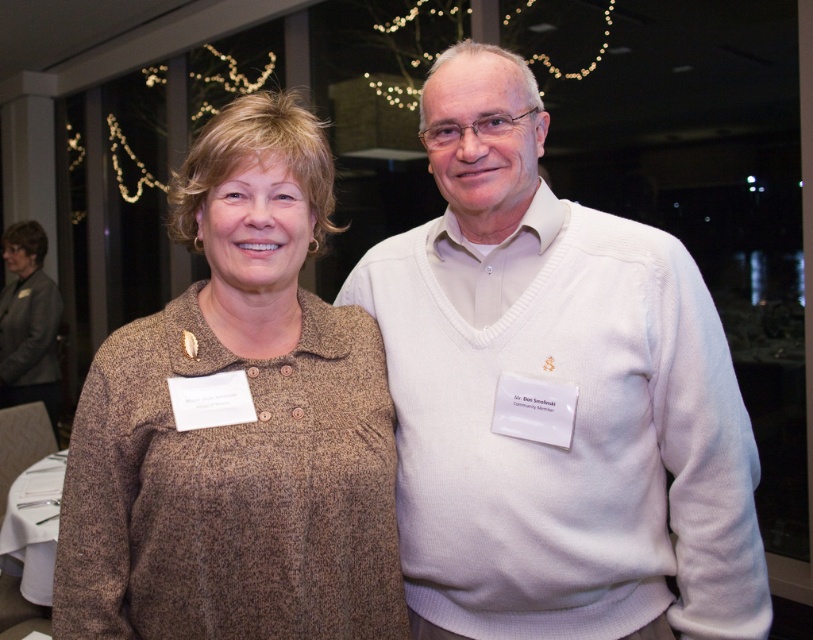
Between white knit sweater at center and brown woolen sweater at center, which one has more height?

With more height is white knit sweater at center.

Is point (466, 92) in front of point (105, 417)?

That is False.

What do you see at coordinates (554, 397) in the screenshot?
I see `white knit sweater at center` at bounding box center [554, 397].

Where is `white knit sweater at center`? The width and height of the screenshot is (813, 640). white knit sweater at center is located at coordinates (554, 397).